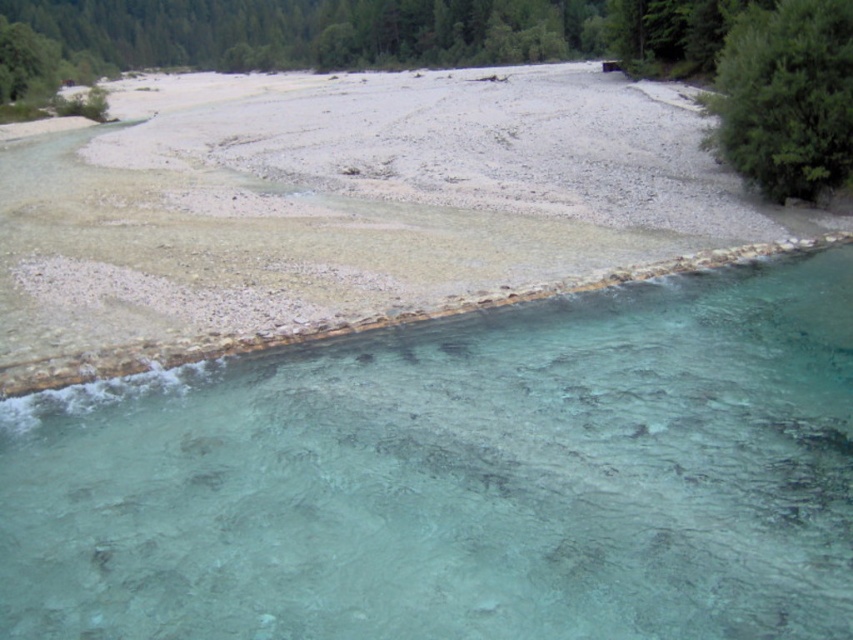
You are standing at the edge of the riverbed and want to cross to the other side. There is a clear glassy water at lower center and a green leafy tree at upper center in your view. Which direction should you head towards to avoid the deeper part of the water?

You should head towards the right of the green leafy tree at upper center because the clear glassy water at lower center is located to the right of the tree, indicating the shallower area where it is safer to cross.

You are standing at the edge of the dry riverbed in the foreground and want to reach the green leafy tree at upper center. The distance between you and the tree is 105.41 feet. If you can walk 3 feet per second, how many minutes will it take you to reach the tree?

The distance between you and the green leafy tree at upper center is 105.41 feet. At a walking speed of 3 feet per second, it would take approximately 35.14 seconds, which is roughly 0.585 minutes. Therefore, it will take about 0.59 minutes to reach the tree.

You are a hiker who wants to cross the riverbed to reach the other side. The clear glassy water at lower center and the green leafy tree at upper right are visible. Which object is smaller in size?

The clear glassy water at lower center is smaller in size compared to the green leafy tree at upper right according to the description.